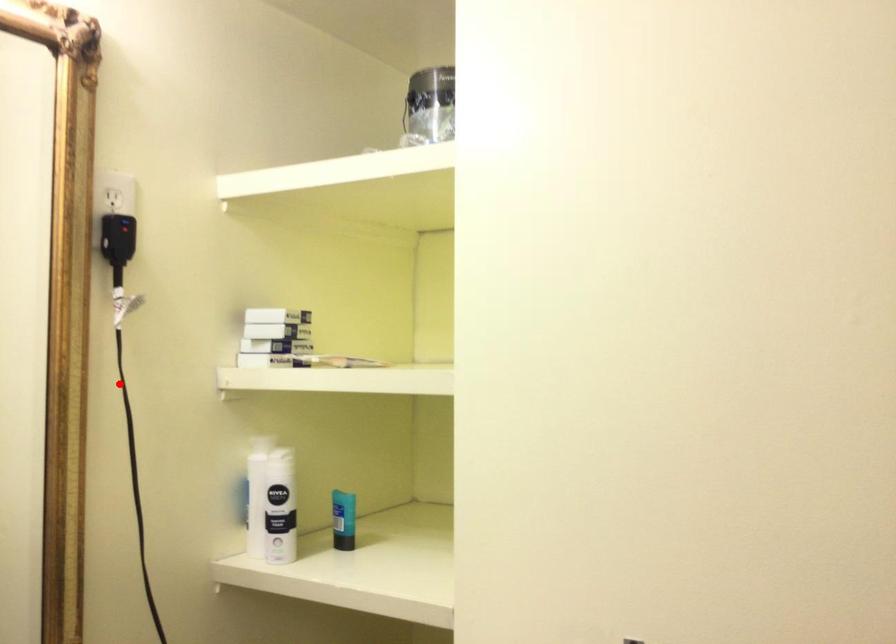
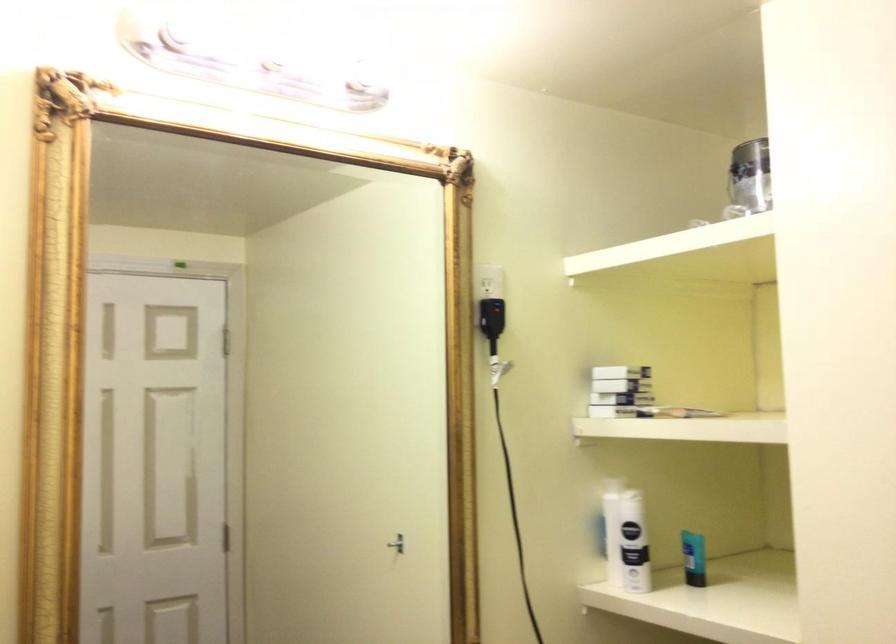
In the second image, find the point that corresponds to the highlighted location in the first image.

(504, 431)